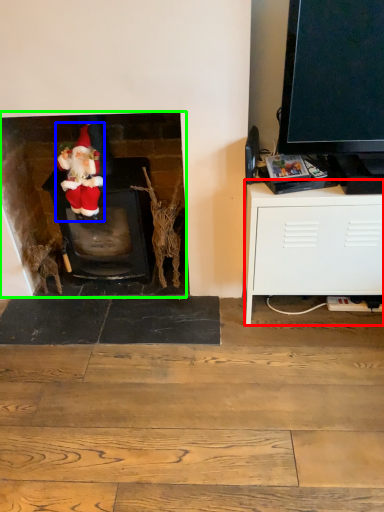
Question: Which object is positioned farthest from cabinetry (highlighted by a red box)? Select from person (highlighted by a blue box) and fireplace (highlighted by a green box).

Choices:
 (A) person
 (B) fireplace

Answer: (A)